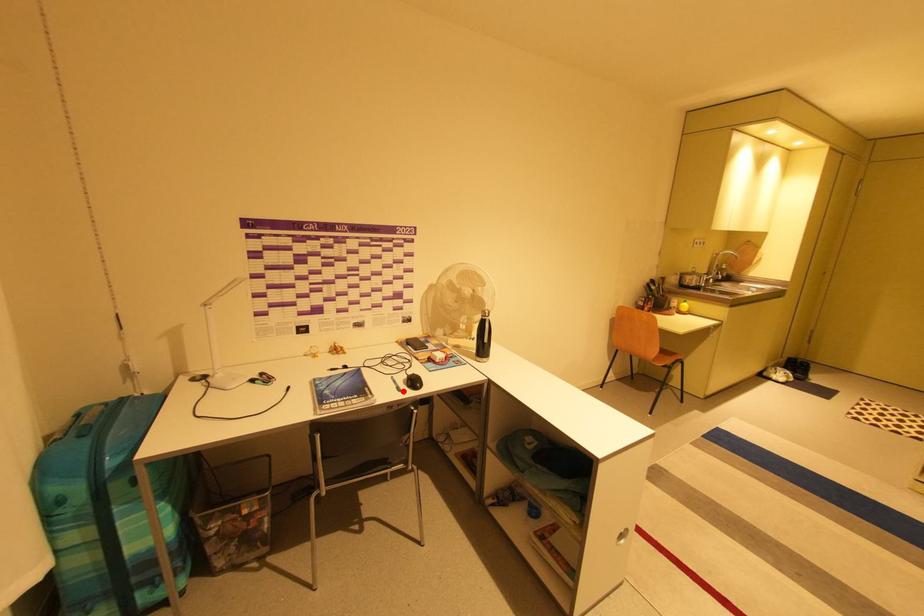
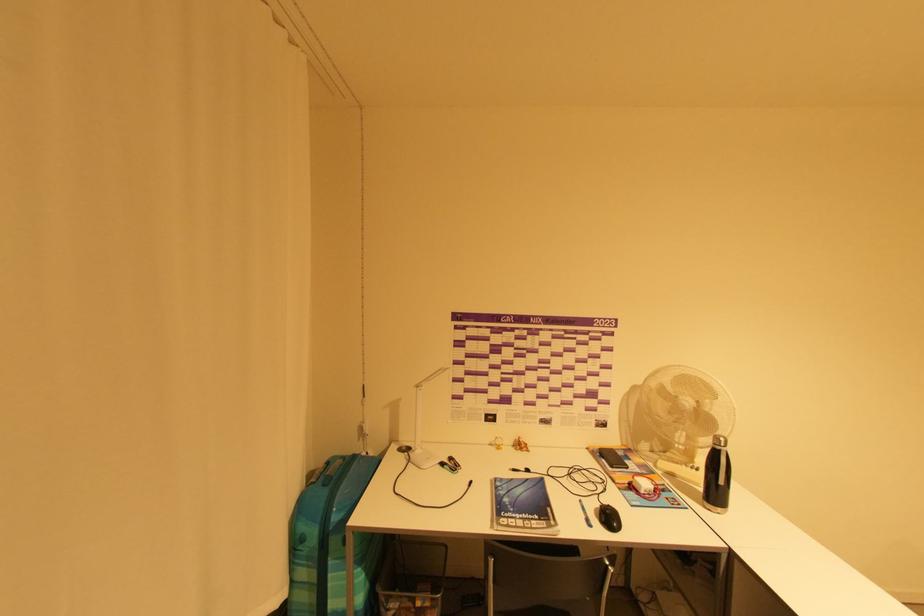
The point at the highlighted location is marked in the first image. Where is the corresponding point in the second image?

(592, 525)